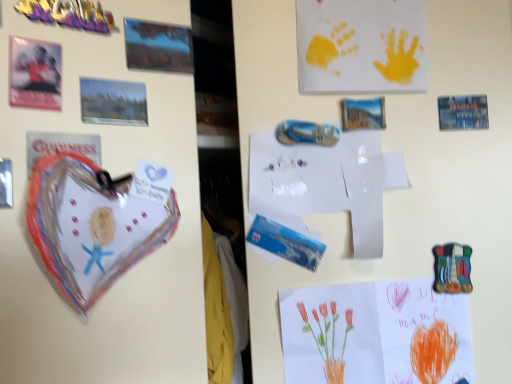
The width and height of the screenshot is (512, 384). Describe the element at coordinates (113, 102) in the screenshot. I see `metallic postcard at upper left, the second postcard from the front` at that location.

Where is `white paper at center`? The height and width of the screenshot is (384, 512). white paper at center is located at coordinates (326, 183).

Locate an element on the screen. Image resolution: width=512 pixels, height=384 pixels. metallic postcard at upper left, acting as the 4th postcard starting from the top is located at coordinates (113, 102).

From the image's perspective, is metallic postcard at upper left, the second postcard from the front, above matte plastic postcard at upper left, marked as the first postcard in a left-to-right arrangement?

No, from the image's perspective, metallic postcard at upper left, the second postcard from the front, is not on top of matte plastic postcard at upper left, marked as the first postcard in a left-to-right arrangement.

Between metallic postcard at upper left, the second postcard from the front, and matte plastic postcard at upper left, the fifth postcard viewed from the right, which one appears on the left side from the viewer's perspective?

matte plastic postcard at upper left, the fifth postcard viewed from the right, is more to the left.

What are the coordinates of `the 1st postcard counting from the right side of the matte plastic postcard at upper left, the third postcard positioned from the top` in the screenshot? It's located at (113, 102).

Considering the sizes of objects metallic postcard at upper left, positioned as the 2th postcard in left-to-right order, and matte plastic postcard at upper left, the third postcard ordered from the bottom, in the image provided, who is smaller, metallic postcard at upper left, positioned as the 2th postcard in left-to-right order, or matte plastic postcard at upper left, the third postcard ordered from the bottom,?

With smaller size is matte plastic postcard at upper left, the third postcard ordered from the bottom.

Can you see metallic postcard at upper left, the third postcard positioned from the back, touching yellow paper handprints at upper center, placed as the first postcard when sorted from top to bottom?

No, metallic postcard at upper left, the third postcard positioned from the back, is not in contact with yellow paper handprints at upper center, placed as the first postcard when sorted from top to bottom.

Does metallic postcard at upper left, the 4th postcard positioned from the bottom, have a lesser width compared to yellow paper handprints at upper center, which appears as the 5th postcard when viewed from the front?

In fact, metallic postcard at upper left, the 4th postcard positioned from the bottom, might be wider than yellow paper handprints at upper center, which appears as the 5th postcard when viewed from the front.

Which is in front, metallic postcard at upper left, the third postcard positioned from the back, or yellow paper handprints at upper center, placed as the first postcard when sorted from top to bottom?

metallic postcard at upper left, the third postcard positioned from the back.

Based on the photo, between metallic/metallic stickers at upper left and yellow paper handprints at upper center, the 4th postcard viewed from the left, which one is positioned behind?

yellow paper handprints at upper center, the 4th postcard viewed from the left, is more distant.

Looking at this image, does metallic/metallic stickers at upper left appear on the left side of yellow paper handprints at upper center, placed as the first postcard when sorted from back to front?

Yes, metallic/metallic stickers at upper left is to the left of yellow paper handprints at upper center, placed as the first postcard when sorted from back to front.

Is metallic/metallic stickers at upper left oriented away from yellow paper handprints at upper center, which ranks as the 2th postcard in right-to-left order?

That's not correct — metallic/metallic stickers at upper left is not looking away from yellow paper handprints at upper center, which ranks as the 2th postcard in right-to-left order.

Looking at this image, is metallic/metallic stickers at upper left inside or outside of yellow paper handprints at upper center, placed as the first postcard when sorted from top to bottom?

metallic/metallic stickers at upper left is outside yellow paper handprints at upper center, placed as the first postcard when sorted from top to bottom.

Is white paper at center not inside metallic/metallic stickers at upper left?

white paper at center lies outside metallic/metallic stickers at upper left's area.

From the image's perspective, which is below, white paper at center or metallic/metallic stickers at upper left?

white paper at center appears lower in the image.

Where is `toy on the left of white paper at center`? This screenshot has width=512, height=384. toy on the left of white paper at center is located at coordinates (69, 14).

From the image's perspective, which is above, metallic/metallic stickers at upper left or white paper at center?

metallic/metallic stickers at upper left, from the image's perspective.

How many degrees apart are the facing directions of metallic/metallic stickers at upper left and white paper at center?

The facing directions of metallic/metallic stickers at upper left and white paper at center are 63.2 degrees apart.

The image size is (512, 384). I want to click on paper on the right of metallic/metallic stickers at upper left, so click(326, 183).

Considering the positions of objects metallic/metallic stickers at upper left and white paper at center in the image provided, who is more to the left, metallic/metallic stickers at upper left or white paper at center?

metallic/metallic stickers at upper left is more to the left.

Looking at their sizes, would you say yellow paper handprints at upper center, which ranks as the 2th postcard in right-to-left order, is wider or thinner than metallic/metallic stickers at upper left?

yellow paper handprints at upper center, which ranks as the 2th postcard in right-to-left order, is wider than metallic/metallic stickers at upper left.

Which point is more distant from viewer, (x=386, y=44) or (x=70, y=2)?

The point (x=386, y=44) is more distant.

What's the angular difference between yellow paper handprints at upper center, which appears as the 5th postcard when viewed from the front, and metallic/metallic stickers at upper left's facing directions?

The angular difference between yellow paper handprints at upper center, which appears as the 5th postcard when viewed from the front, and metallic/metallic stickers at upper left is 26.6 degrees.

Are yellow paper handprints at upper center, which appears as the 5th postcard when viewed from the front, and metallic/metallic stickers at upper left far apart?

That's not correct — yellow paper handprints at upper center, which appears as the 5th postcard when viewed from the front, is a little close to metallic/metallic stickers at upper left.

Considering the sizes of objects metallic postcard at upper left, acting as the 4th postcard starting from the top, and yellow paper handprints at upper center, which appears as the 5th postcard when viewed from the front, in the image provided, who is taller, metallic postcard at upper left, acting as the 4th postcard starting from the top, or yellow paper handprints at upper center, which appears as the 5th postcard when viewed from the front,?

With more height is yellow paper handprints at upper center, which appears as the 5th postcard when viewed from the front.

From the picture: Is metallic postcard at upper left, the second postcard from the front, in contact with yellow paper handprints at upper center, which ranks as the 2th postcard in right-to-left order?

No, metallic postcard at upper left, the second postcard from the front, is not next to yellow paper handprints at upper center, which ranks as the 2th postcard in right-to-left order.

From the matte plastic postcard at upper left, acting as the first postcard starting from the front, count 1st postcard to the right and point to it. Please provide its 2D coordinates.

[(113, 102)]

From the metallic postcard at upper left, which is the second postcard from top to bottom, count 2nd postcards backward and point to it. Please provide its 2D coordinates.

[(361, 46)]

When comparing their distances from metallic/metallic stickers at upper left, does white paper at center or matte plastic postcard at upper left, the third postcard ordered from the bottom, seem closer?

matte plastic postcard at upper left, the third postcard ordered from the bottom.

Which object lies nearer to the anchor point metallic postcard at upper left, the second postcard from the front, metallic postcard at upper left, the third postcard positioned from the back, or yellow paper handprints at upper center, placed as the first postcard when sorted from top to bottom?

Based on the image, metallic postcard at upper left, the third postcard positioned from the back, appears to be nearer to metallic postcard at upper left, the second postcard from the front.

Which object lies further to the anchor point metallic postcard at upper left, acting as the 4th postcard starting from the top, yellow paper handprints at upper center, the 4th postcard viewed from the left, or metallic postcard at upper left, which ranks as the third postcard in right-to-left order?

yellow paper handprints at upper center, the 4th postcard viewed from the left, is further to metallic postcard at upper left, acting as the 4th postcard starting from the top.

Which object lies further to the anchor point matte plastic postcard at upper left, marked as the first postcard in a left-to-right arrangement, metallic postcard at upper left, which is the 3th postcard in left-to-right order, or metallic postcard at upper left, positioned as the 4th postcard in right-to-left order?

Based on the image, metallic postcard at upper left, which is the 3th postcard in left-to-right order, appears to be further to matte plastic postcard at upper left, marked as the first postcard in a left-to-right arrangement.

Based on their spatial positions, is watercolor paper flowers at lower right, which is the fifth postcard in top-to-bottom order, or matte plastic postcard at upper left, acting as the first postcard starting from the front, further from metallic/metallic stickers at upper left?

Based on the image, watercolor paper flowers at lower right, which is the fifth postcard in top-to-bottom order, appears to be further to metallic/metallic stickers at upper left.

From the image, which object appears to be nearer to matte plastic postcard at upper left, acting as the first postcard starting from the front, watercolor paper flowers at lower right, the 5th postcard from the left, or white paper at center?

The object closer to matte plastic postcard at upper left, acting as the first postcard starting from the front, is white paper at center.

When comparing their distances from yellow paper handprints at upper center, which appears as the 5th postcard when viewed from the front, does metallic postcard at upper left, the 3th postcard when ordered from front to back, or white paper at center seem closer?

Based on the image, white paper at center appears to be nearer to yellow paper handprints at upper center, which appears as the 5th postcard when viewed from the front.

When comparing their distances from white paper at center, does yellow paper handprints at upper center, which appears as the 5th postcard when viewed from the front, or watercolor paper flowers at lower right, which appears as the 1th postcard when viewed from the right, seem further?

The object further to white paper at center is watercolor paper flowers at lower right, which appears as the 1th postcard when viewed from the right.

Identify the location of paper between metallic postcard at upper left, the 3th postcard when ordered from front to back, and yellow paper handprints at upper center, which ranks as the 2th postcard in right-to-left order, from left to right. (326, 183).

In order to click on postcard situated between metallic postcard at upper left, positioned as the 2th postcard in left-to-right order, and white paper at center from left to right in this screenshot , I will do `click(158, 46)`.

The image size is (512, 384). Identify the location of postcard situated between metallic postcard at upper left, acting as the 4th postcard starting from the top, and yellow paper handprints at upper center, placed as the first postcard when sorted from back to front, from left to right. (158, 46).

Where is `paper between metallic/metallic stickers at upper left and yellow paper handprints at upper center, placed as the first postcard when sorted from top to bottom, in the horizontal direction`? This screenshot has width=512, height=384. paper between metallic/metallic stickers at upper left and yellow paper handprints at upper center, placed as the first postcard when sorted from top to bottom, in the horizontal direction is located at coordinates (326, 183).